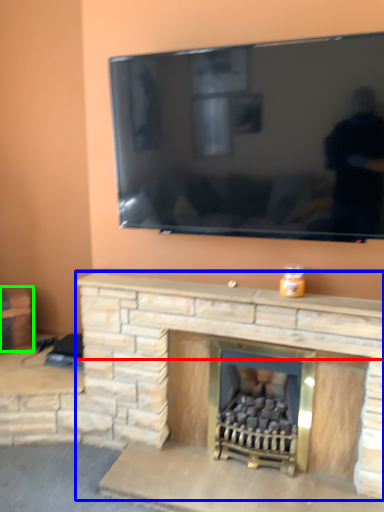
Question: Which object is the closest to the mantle (highlighted by a red box)? Choose among these: fireplace (highlighted by a blue box) or furniture (highlighted by a green box).

Choices:
 (A) fireplace
 (B) furniture

Answer: (A)